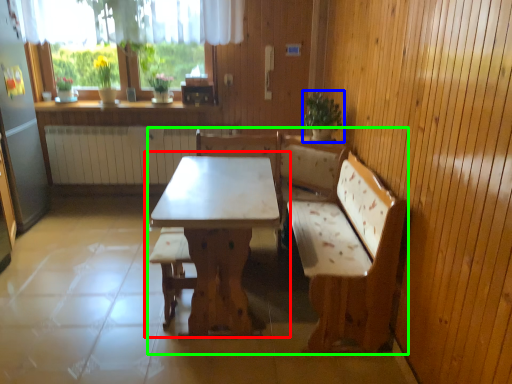
Question: Considering the real-world distances, which object is farthest from table (highlighted by a red box)? houseplant (highlighted by a blue box) or furniture (highlighted by a green box)?

Choices:
 (A) houseplant
 (B) furniture

Answer: (A)